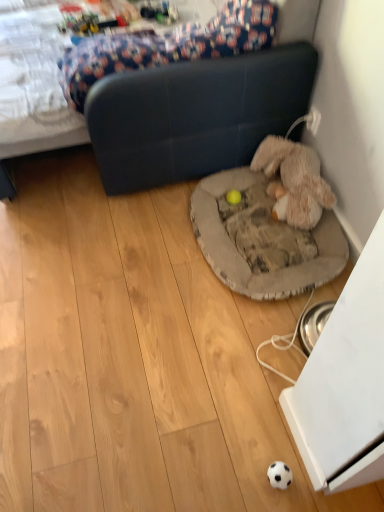
Question: Which direction should I rotate to look at yellow rubber ball at center, marked as the 2th toy in a right-to-left arrangement, — up or down?

Choices:
 (A) up
 (B) down

Answer: (A)

Question: Is gray fabric dog bed at center beside fuzzy beige stuffed animal at lower right, the 2th toy from the left?

Choices:
 (A) no
 (B) yes

Answer: (A)

Question: Can you confirm if gray fabric dog bed at center is taller than fuzzy beige stuffed animal at lower right, the 2th toy from the left?

Choices:
 (A) yes
 (B) no

Answer: (B)

Question: Considering the relative sizes of gray fabric dog bed at center and fuzzy beige stuffed animal at lower right, the 2th toy from the left, in the image provided, is gray fabric dog bed at center thinner than fuzzy beige stuffed animal at lower right, the 2th toy from the left,?

Choices:
 (A) yes
 (B) no

Answer: (B)

Question: Is gray fabric dog bed at center behind fuzzy beige stuffed animal at lower right, which ranks as the 1th toy in right-to-left order?

Choices:
 (A) no
 (B) yes

Answer: (A)

Question: Is gray fabric dog bed at center wider than fuzzy beige stuffed animal at lower right, which ranks as the 1th toy in right-to-left order?

Choices:
 (A) yes
 (B) no

Answer: (A)

Question: From the image's perspective, is gray fabric dog bed at center on top of fuzzy beige stuffed animal at lower right, the 2th toy from the left?

Choices:
 (A) no
 (B) yes

Answer: (A)

Question: Does yellow rubber ball at center, marked as the 2th toy in a right-to-left arrangement, appear on the left side of dark blue leather studio couch at center?

Choices:
 (A) no
 (B) yes

Answer: (A)

Question: Are yellow rubber ball at center, which ranks as the 1th toy in left-to-right order, and dark blue leather studio couch at center located far from each other?

Choices:
 (A) no
 (B) yes

Answer: (A)

Question: Does yellow rubber ball at center, which ranks as the 1th toy in left-to-right order, come behind dark blue leather studio couch at center?

Choices:
 (A) yes
 (B) no

Answer: (A)

Question: Considering the relative sizes of yellow rubber ball at center, marked as the 2th toy in a right-to-left arrangement, and dark blue leather studio couch at center in the image provided, is yellow rubber ball at center, marked as the 2th toy in a right-to-left arrangement, taller than dark blue leather studio couch at center?

Choices:
 (A) no
 (B) yes

Answer: (A)

Question: Could you tell me if yellow rubber ball at center, which ranks as the 1th toy in left-to-right order, is turned towards dark blue leather studio couch at center?

Choices:
 (A) no
 (B) yes

Answer: (A)

Question: Is yellow rubber ball at center, which ranks as the 1th toy in left-to-right order, placed right next to dark blue leather studio couch at center?

Choices:
 (A) yes
 (B) no

Answer: (B)

Question: From the image's perspective, is dark blue leather studio couch at center above yellow rubber ball at center, which ranks as the 1th toy in left-to-right order?

Choices:
 (A) no
 (B) yes

Answer: (B)